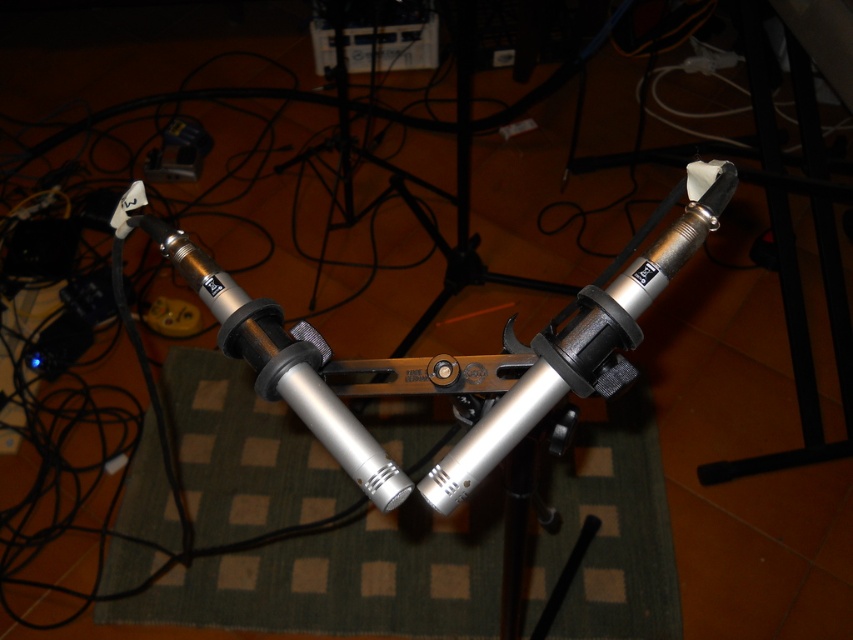
You are setting up a stereo microphone array and need to ensure the microphones are spaced correctly. The recommended minimum distance between the two microphones is 24 inches. Given the current setup, can the silver metallic tripod at center and the green woven mat at center be used as reference points to achieve the required spacing?

The distance between the green woven mat at center and the silver metallic tripod at center is 25.96 inches, which exceeds the recommended minimum of 24 inches. Therefore, using these two reference points would allow the microphones to be spaced appropriately.

Consider the image. You are a sound engineer who needs to adjust the microphones. You are standing 1.5 meters away from the green woven mat at center. Can you reach the microphones without moving closer to the mat?

The green woven mat at center is 1.44 meters away from the viewer. Since you are standing 1.5 meters away from the green woven mat at center, you are slightly farther than the mat itself. However, the microphones are mounted on stands that are resting on the mat. The distance between you and the microphones would depend on how far the stands extend beyond the mat. Without specific information about the stand height or extension, it is uncertain if you can reach them without moving closer.

You are setting up a stereo microphone pair on a green woven mat at center and a silver metallic tripod at center. Which object should you place first to ensure the microphones are stable?

The silver metallic tripod at center should be placed first because the green woven mat at center is located below it, providing a stable base for the tripod.